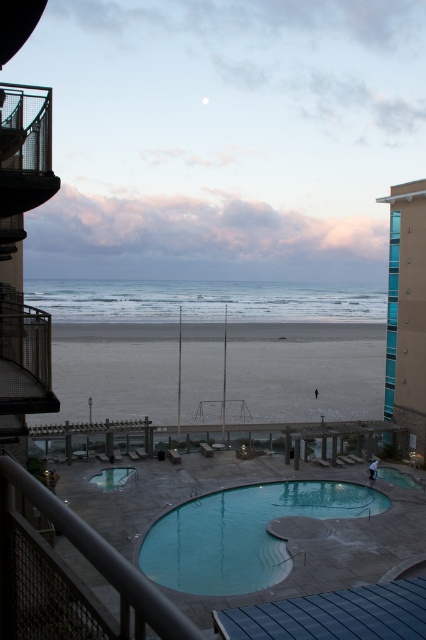
Between metallic balcony at left and clear glass pool at lower right, which one is positioned lower?

clear glass pool at lower right is below.

Is metallic balcony at left below clear glass pool at lower right?

No, metallic balcony at left is not below clear glass pool at lower right.

Is point (0, 360) positioned in front of point (411, 476)?

Yes, it is in front of point (411, 476).

This screenshot has width=426, height=640. I want to click on metallic balcony at left, so click(x=23, y=356).

Can you confirm if teal glass building at right is positioned to the right of metal mesh balcony at upper left?

Indeed, teal glass building at right is positioned on the right side of metal mesh balcony at upper left.

Who is taller, teal glass building at right or metal mesh balcony at upper left?

Standing taller between the two is teal glass building at right.

Describe the element at coordinates (406, 310) in the screenshot. The image size is (426, 640). I see `teal glass building at right` at that location.

The image size is (426, 640). Identify the location of teal glass building at right. (406, 310).

Based on the photo, is metallic balcony at left further to camera compared to smooth blue pool at center?

No, metallic balcony at left is closer to the viewer.

Find the location of `metallic balcony at left`. metallic balcony at left is located at coordinates (23, 356).